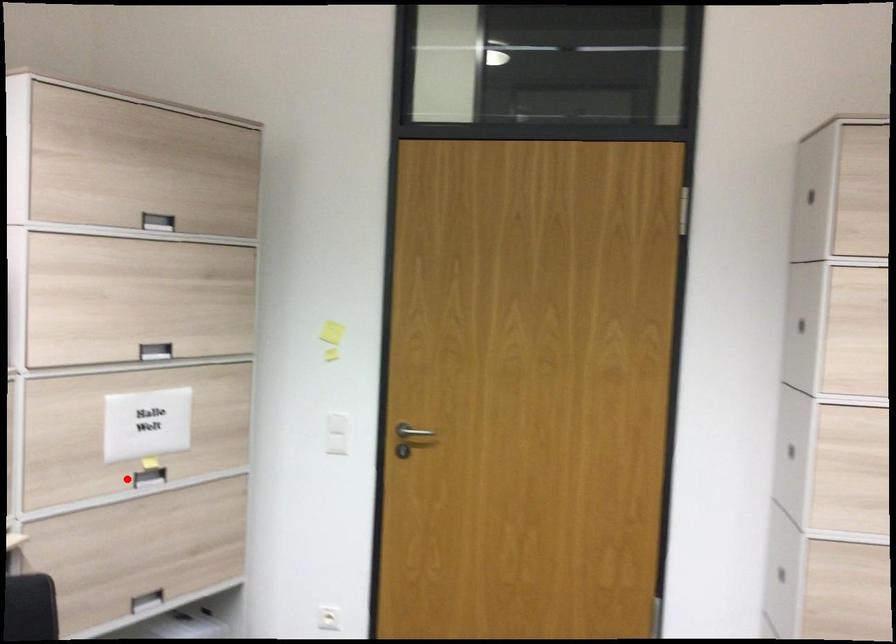
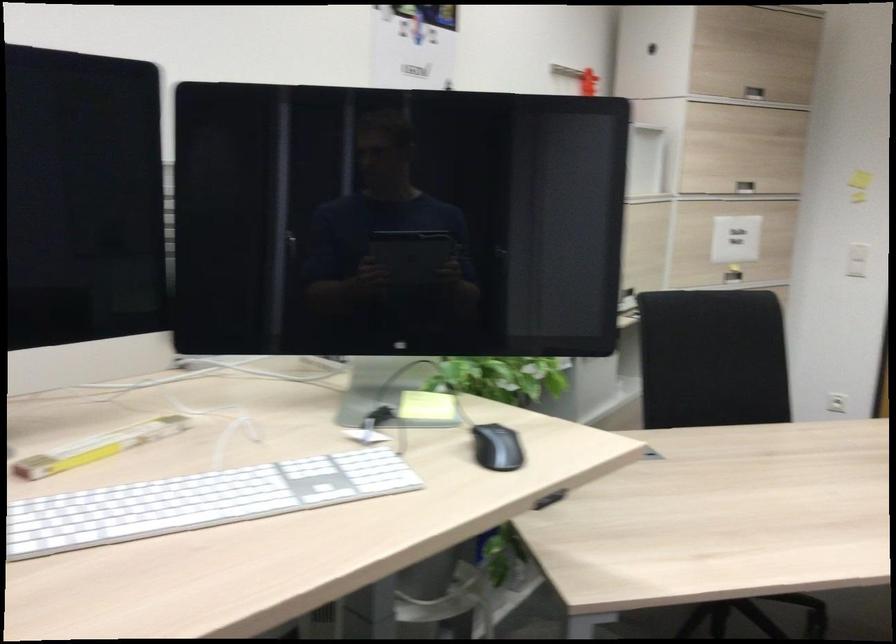
The point at the highlighted location is marked in the first image. Where is the corresponding point in the second image?

(733, 275)